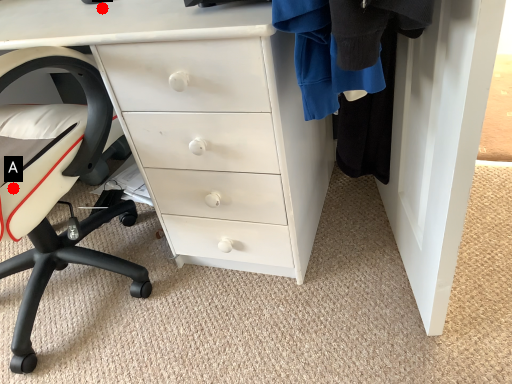
Question: Two points are circled on the image, labeled by A and B beside each circle. Which point is farther from the camera taking this photo?

Choices:
 (A) A is further
 (B) B is further

Answer: (B)